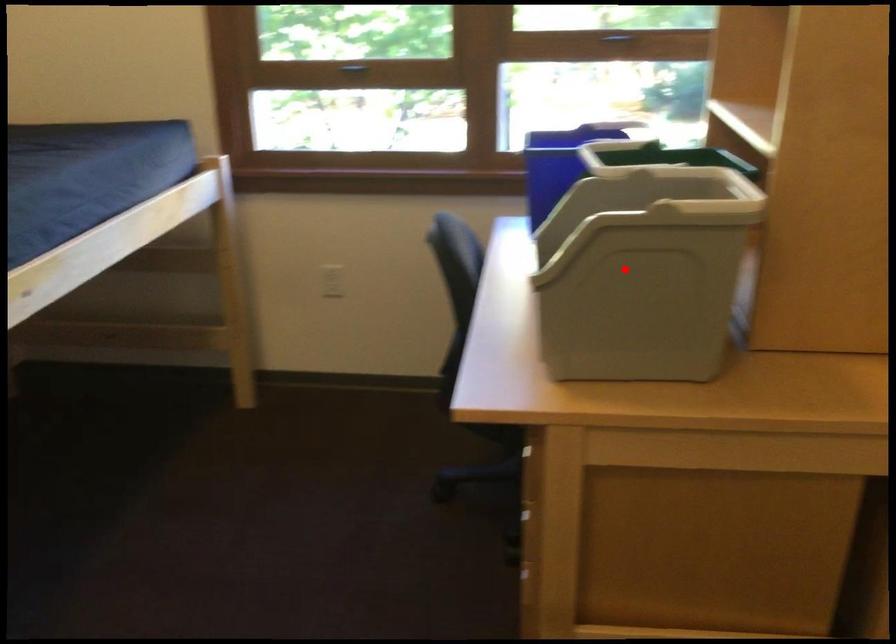
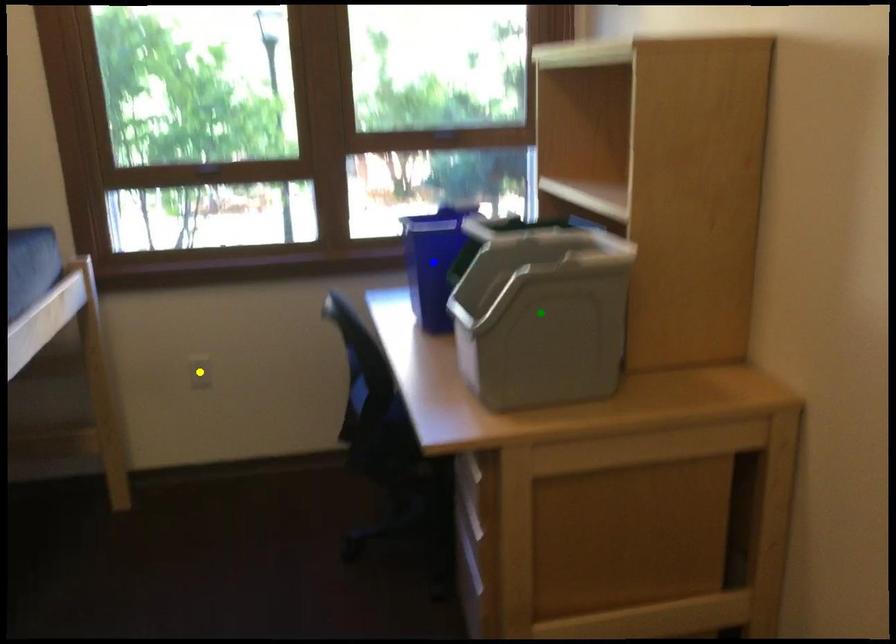
Question: I am providing you with two images of the same scene from different viewpoints. A red point is marked on the first image. You are given multiple points on the second image. Which point in image 2 is actually the same real-world point as the red point in image 1?

Choices:
 (A) yellow point
 (B) green point
 (C) blue point

Answer: (B)